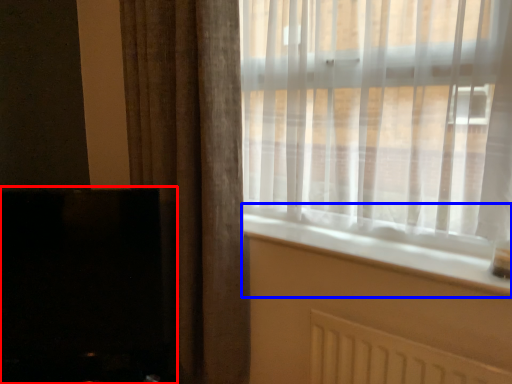
Question: Which of the following is the farthest to the observer, fireplace (highlighted by a red box) or window sill (highlighted by a blue box)?

Choices:
 (A) fireplace
 (B) window sill

Answer: (A)